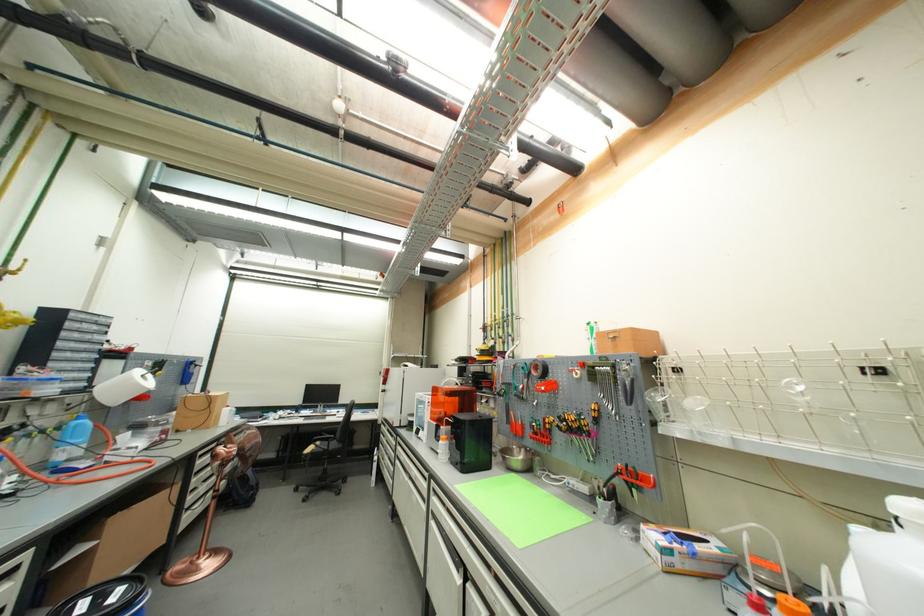
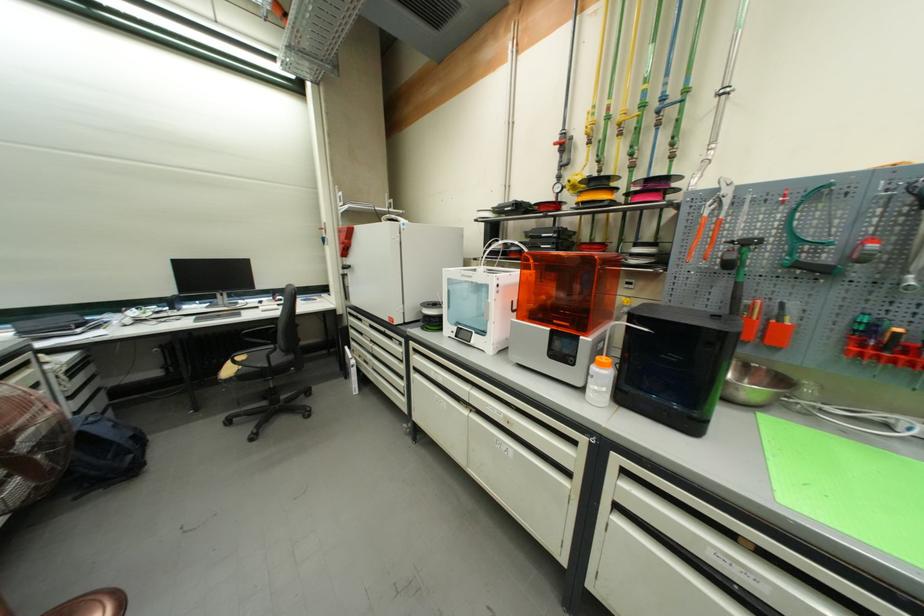
Where in the second image is the point corresponding to point (503, 370) from the first image?

(719, 208)